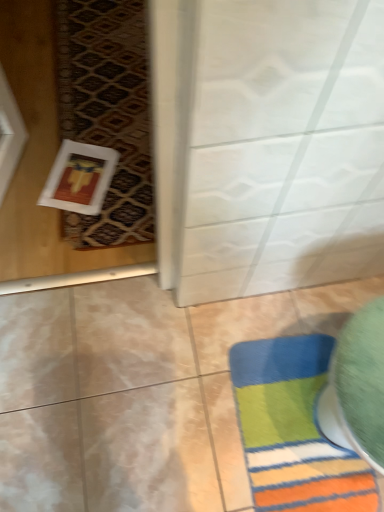
Question: Is white textured mat at left located outside multicolored plush bath mat at lower right?

Choices:
 (A) yes
 (B) no

Answer: (A)

Question: Does white textured mat at left have a greater height compared to multicolored plush bath mat at lower right?

Choices:
 (A) yes
 (B) no

Answer: (B)

Question: From the image's perspective, is white textured mat at left above multicolored plush bath mat at lower right?

Choices:
 (A) yes
 (B) no

Answer: (A)

Question: Can you confirm if white textured mat at left is positioned to the left of multicolored plush bath mat at lower right?

Choices:
 (A) yes
 (B) no

Answer: (A)

Question: Is white textured mat at left facing towards multicolored plush bath mat at lower right?

Choices:
 (A) no
 (B) yes

Answer: (A)

Question: Can you confirm if white textured mat at left is shorter than multicolored plush bath mat at lower right?

Choices:
 (A) yes
 (B) no

Answer: (A)

Question: Is multicolored plush bath mat at lower right far away from white textured mat at left?

Choices:
 (A) no
 (B) yes

Answer: (A)

Question: Considering the relative sizes of multicolored plush bath mat at lower right and white textured mat at left in the image provided, is multicolored plush bath mat at lower right taller than white textured mat at left?

Choices:
 (A) no
 (B) yes

Answer: (B)

Question: Considering the relative positions of multicolored plush bath mat at lower right and white textured mat at left in the image provided, is multicolored plush bath mat at lower right behind white textured mat at left?

Choices:
 (A) yes
 (B) no

Answer: (B)

Question: From the image's perspective, is multicolored plush bath mat at lower right on top of white textured mat at left?

Choices:
 (A) yes
 (B) no

Answer: (B)

Question: Are multicolored plush bath mat at lower right and white textured mat at left making contact?

Choices:
 (A) yes
 (B) no

Answer: (B)

Question: From a real-world perspective, is multicolored plush bath mat at lower right physically below white textured mat at left?

Choices:
 (A) yes
 (B) no

Answer: (A)

Question: Considering the positions of white textured mat at left and multicolored plush bath mat at lower right in the image, is white textured mat at left bigger or smaller than multicolored plush bath mat at lower right?

Choices:
 (A) small
 (B) big

Answer: (B)